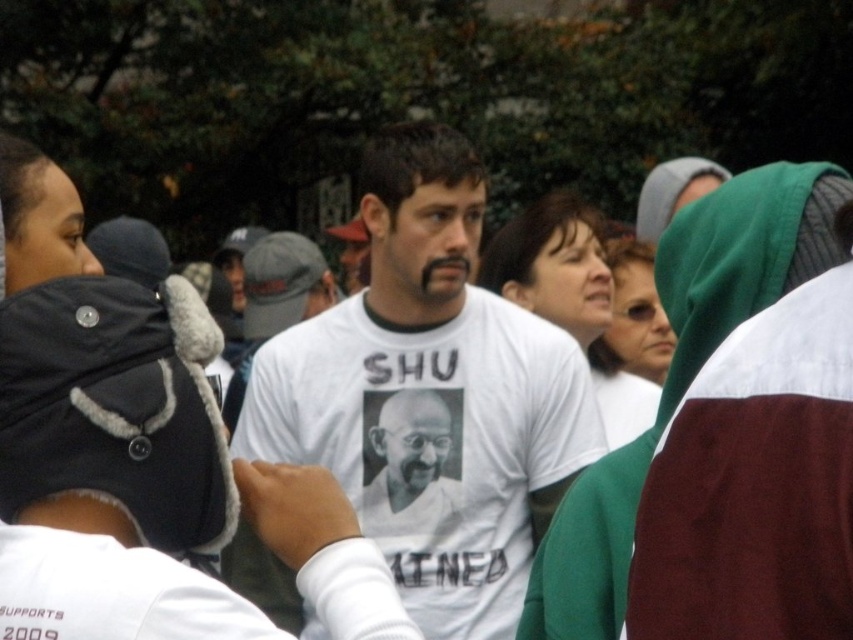
Which is behind, point (802, 200) or point (401, 483)?

Positioned behind is point (401, 483).

Can you confirm if green fabric headscarf at upper right is shorter than white printed t-shirt at center?

No.

Describe the element at coordinates (682, 371) in the screenshot. I see `green fabric headscarf at upper right` at that location.

Locate an element on the screen. The height and width of the screenshot is (640, 853). green fabric headscarf at upper right is located at coordinates (682, 371).

Between white t-shirt at center and white printed t-shirt at center, which one is positioned lower?

white printed t-shirt at center is lower down.

Is point (450, 380) positioned before point (457, 451)?

That is False.

Is point (380, 524) in front of point (367, 483)?

No, (380, 524) is further to viewer.

This screenshot has height=640, width=853. I want to click on white t-shirt at center, so click(431, 396).

Is white t-shirt at center taller than green fabric headscarf at upper right?

Yes, white t-shirt at center is taller than green fabric headscarf at upper right.

The width and height of the screenshot is (853, 640). Describe the element at coordinates (431, 396) in the screenshot. I see `white t-shirt at center` at that location.

Image resolution: width=853 pixels, height=640 pixels. I want to click on white t-shirt at center, so click(x=431, y=396).